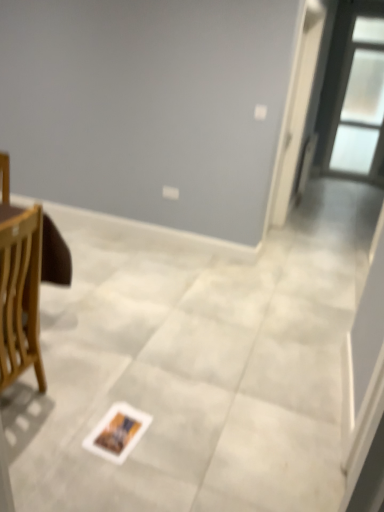
I want to click on vacant region to the right of white glossy screen door at upper right, so click(x=315, y=236).